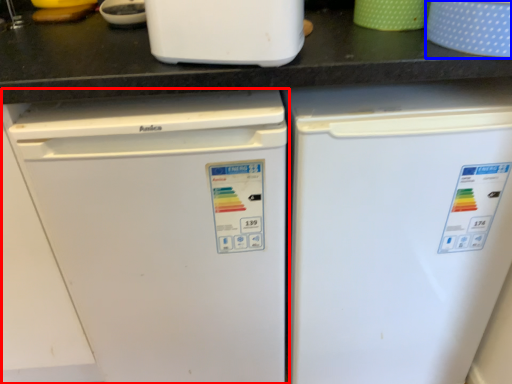
Question: Which point is closer to the camera, refrigerator (highlighted by a red box) or appliance (highlighted by a blue box)?

Choices:
 (A) refrigerator
 (B) appliance

Answer: (B)